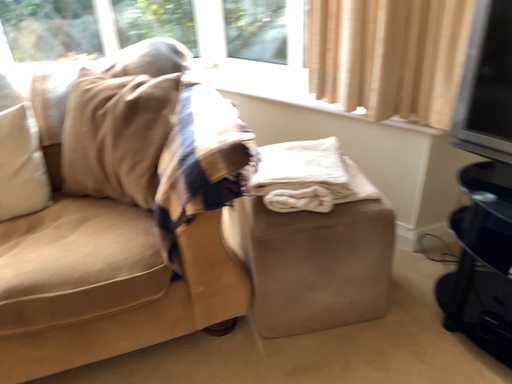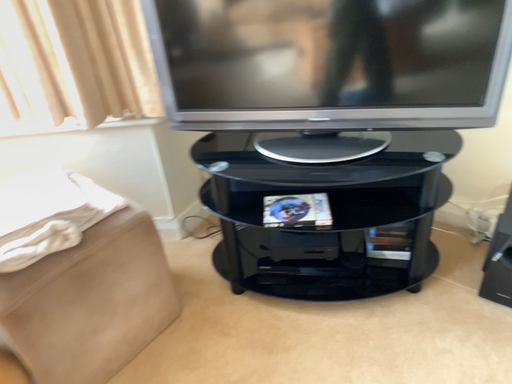
Question: How did the camera likely rotate when shooting the video?

Choices:
 (A) rotated right
 (B) rotated left

Answer: (A)